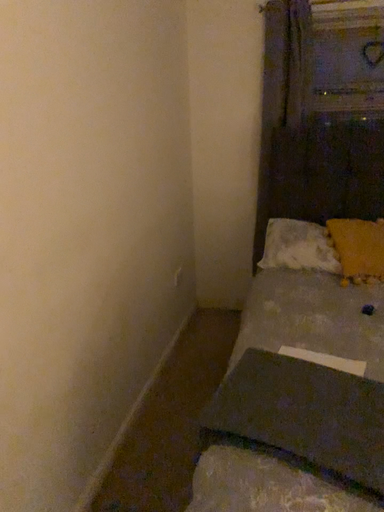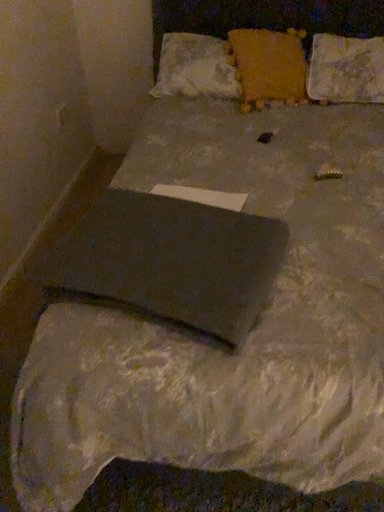
Question: How did the camera likely rotate when shooting the video?

Choices:
 (A) rotated downward
 (B) rotated upward

Answer: (A)